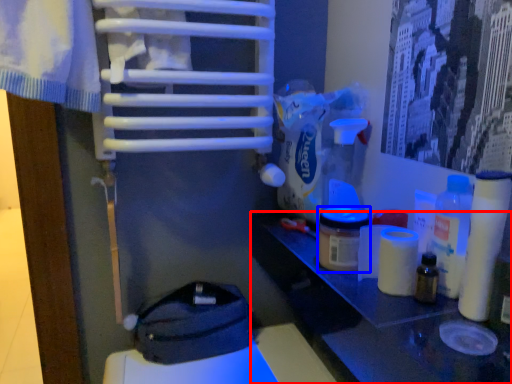
Question: Among these objects, which one is nearest to the camera, table (highlighted by a red box) or product (highlighted by a blue box)?

Choices:
 (A) table
 (B) product

Answer: (A)